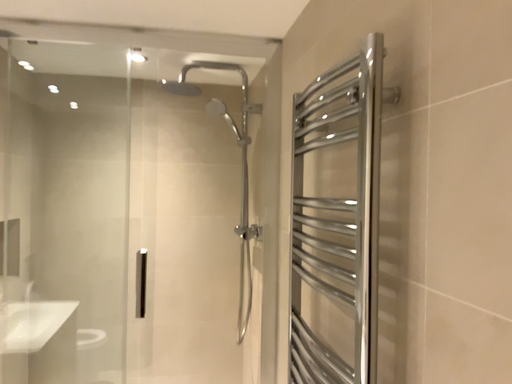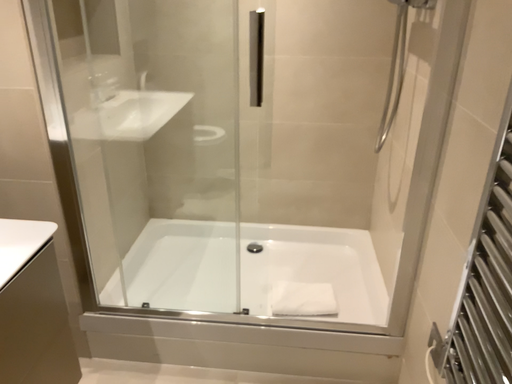
Question: How did the camera likely rotate when shooting the video?

Choices:
 (A) rotated downward
 (B) rotated upward

Answer: (A)